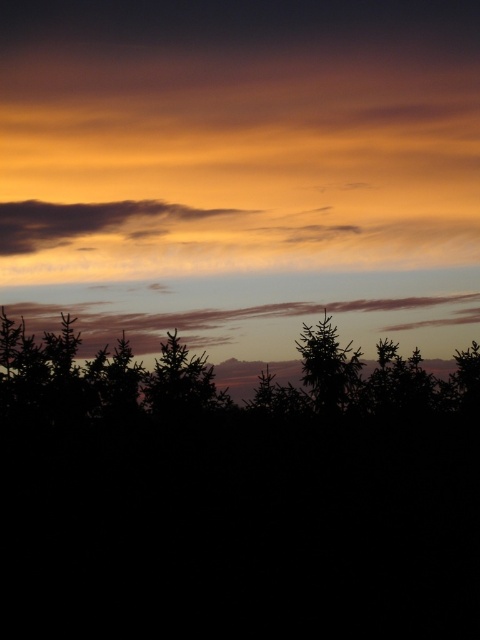
Can you confirm if black silhouetted tree at center is positioned above translucent orange cloud at upper center?

No, black silhouetted tree at center is not above translucent orange cloud at upper center.

Can you confirm if black silhouetted tree at center is wider than translucent orange cloud at upper center?

In fact, black silhouetted tree at center might be narrower than translucent orange cloud at upper center.

Locate an element on the screen. black silhouetted tree at center is located at coordinates (232, 500).

Does point (6, 204) come farther from viewer compared to point (336, 401)?

Yes, it is.

Which is behind, point (78, 236) or point (336, 353)?

Point (78, 236)

What do you see at coordinates (95, 221) in the screenshot? I see `translucent orange cloud at upper center` at bounding box center [95, 221].

You are a GUI agent. You are given a task and a screenshot of the screen. Output one action in this format:
    pyautogui.click(x=<x>, y=<y>)
    Task: Click on the translucent orange cloud at upper center
    This screenshot has height=640, width=480.
    Given the screenshot: What is the action you would take?
    pyautogui.click(x=95, y=221)

Is point (20, 228) farther from viewer compared to point (153, 372)?

That is True.

Between translucent orange cloud at upper center and silhouette tree at center, which one has less height?

silhouette tree at center is shorter.

Describe the element at coordinates (95, 221) in the screenshot. I see `translucent orange cloud at upper center` at that location.

You are a GUI agent. You are given a task and a screenshot of the screen. Output one action in this format:
    pyautogui.click(x=<x>, y=<y>)
    Task: Click on the translucent orange cloud at upper center
    The image size is (480, 640).
    Given the screenshot: What is the action you would take?
    [95, 221]